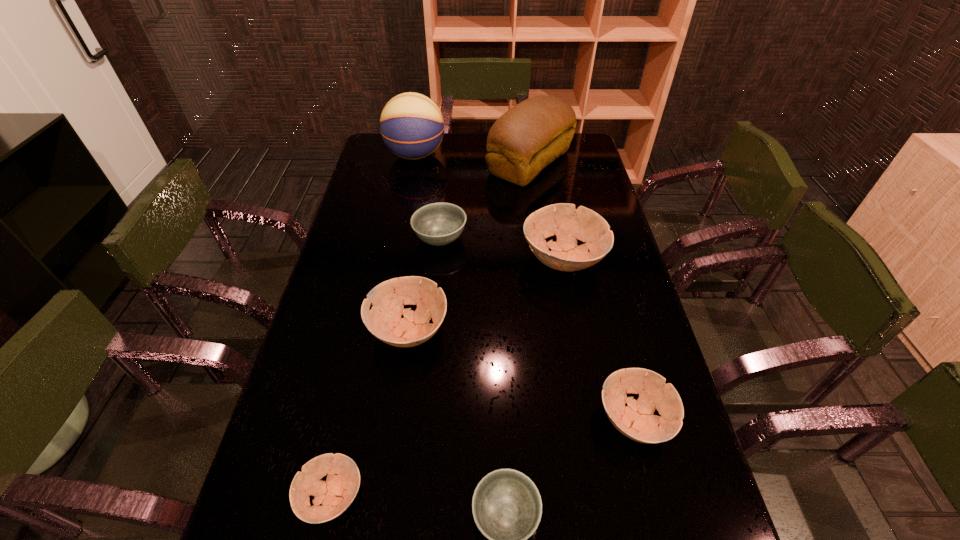
Identify the location of basketball. (412, 127).

Locate an element on the screen. This screenshot has width=960, height=540. bread is located at coordinates (534, 133).

Identify the location of the farthest brown bowl. (568, 224).

You are a GUI agent. You are given a task and a screenshot of the screen. Output one action in this format:
    pyautogui.click(x=<x>, y=<y>)
    Task: Click on the tallest bowl
    The height and width of the screenshot is (540, 960).
    Given the screenshot: What is the action you would take?
    pyautogui.click(x=568, y=224)

At what (x,y) coordinates should I click in order to perform the action: click on the fifth farthest object. Please return your answer as a coordinate pair (x, y). Looking at the image, I should click on (384, 321).

In order to click on the fourth nearest bowl in this screenshot , I will do `click(384, 321)`.

What are the coordinates of `the farther gray bowl` in the screenshot? It's located at (438, 224).

You are a GUI agent. You are given a task and a screenshot of the screen. Output one action in this format:
    pyautogui.click(x=<x>, y=<y>)
    Task: Click on the bigger gray bowl
    This screenshot has width=960, height=540.
    Given the screenshot: What is the action you would take?
    pyautogui.click(x=438, y=224)

You are a GUI agent. You are given a task and a screenshot of the screen. Output one action in this format:
    pyautogui.click(x=<x>, y=<y>)
    Task: Click on the third nearest bowl
    This screenshot has width=960, height=540.
    Given the screenshot: What is the action you would take?
    pyautogui.click(x=636, y=421)

The height and width of the screenshot is (540, 960). Identify the location of the sixth farthest object. (636, 421).